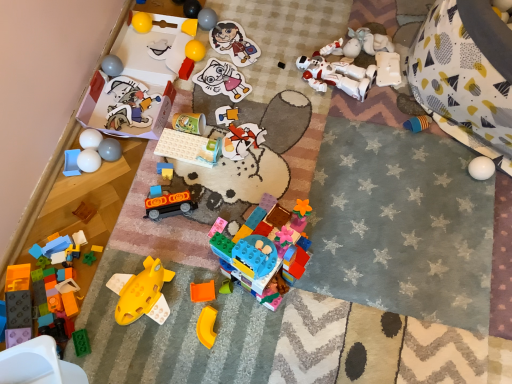
I want to click on vacant area that lies between yellow rubber ball at upper center, the tenth toy from the right, and white plastic robot at upper right, which appears as the second toy when viewed from the right, so click(265, 65).